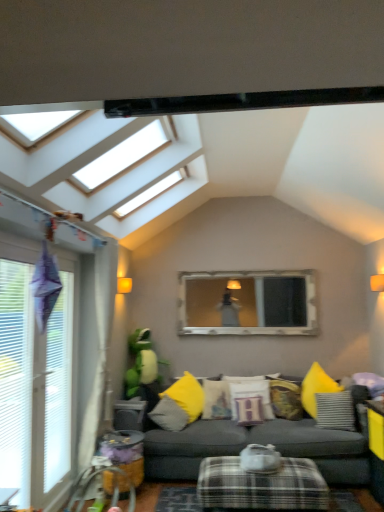
Question: From the image's perspective, is plaid fabric ottoman at lower center positioned above or below silver-framed mirror at center?

Choices:
 (A) below
 (B) above

Answer: (A)

Question: Considering the positions of plaid fabric ottoman at lower center and silver-framed mirror at center in the image, is plaid fabric ottoman at lower center taller or shorter than silver-framed mirror at center?

Choices:
 (A) short
 (B) tall

Answer: (A)

Question: Considering the real-world distances, which object is farthest from the textured yellow pillow at center, acting as the 2th pillow starting from the right?

Choices:
 (A) silver-framed mirror at center
 (B) matte gray couch at center
 (C) white plastic window at left
 (D) plaid fabric ottoman at lower center
 (E) yellow fabric pillow at center, which is counted as the first pillow, starting from the left

Answer: (C)

Question: Which of these objects is positioned farthest from the yellow fabric pillow at center, which is counted as the first pillow, starting from the left?

Choices:
 (A) beige fabric curtain at left
 (B) white cotton pillow at center, placed as the third pillow when sorted from left to right
 (C) silver-framed mirror at center
 (D) matte yellow pillow at center, the second pillow in the left-to-right sequence
 (E) textured yellow pillow at center, the 4th pillow viewed from the left

Answer: (C)